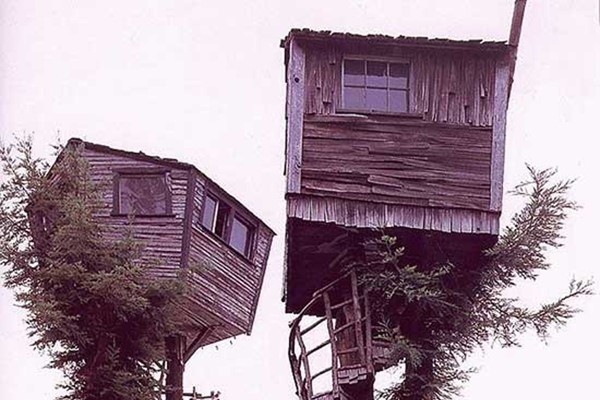
Where is `bracket for support`? This screenshot has height=400, width=600. bracket for support is located at coordinates (192, 343).